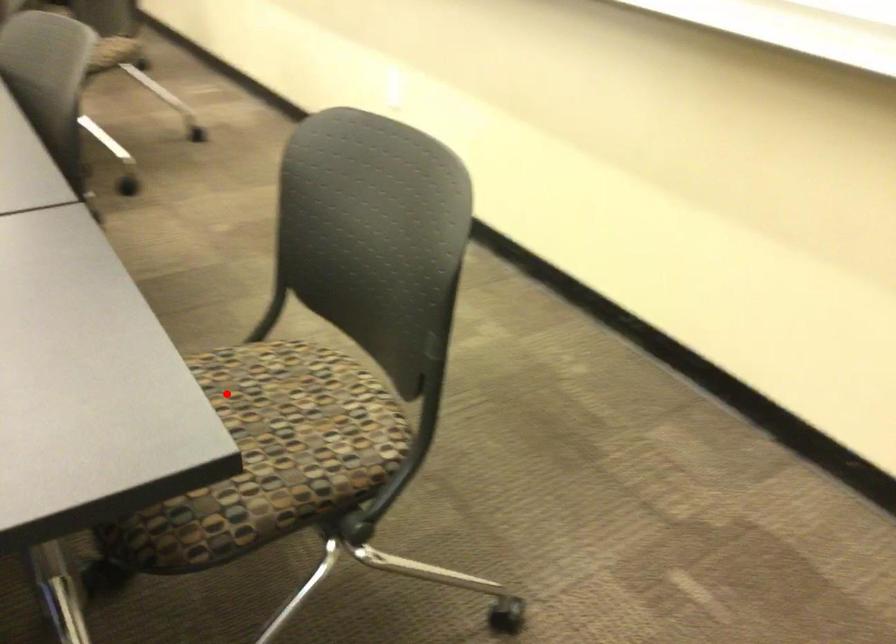
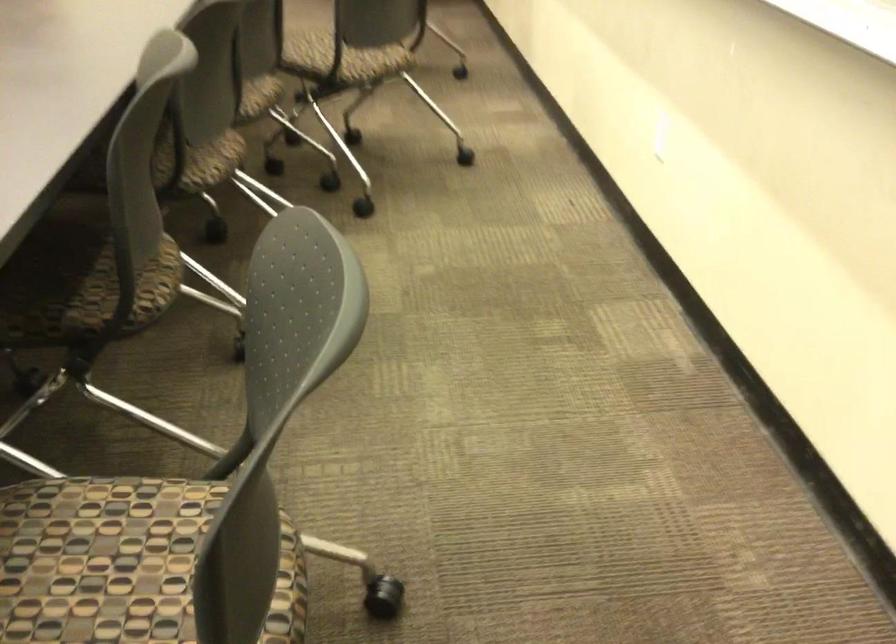
Question: I am providing you with two images of the same scene from different viewpoints. Given a red point in image1, look at the same physical point in image2. Is it:

Choices:
 (A) Closer to the viewpoint
 (B) Farther from the viewpoint

Answer: (A)